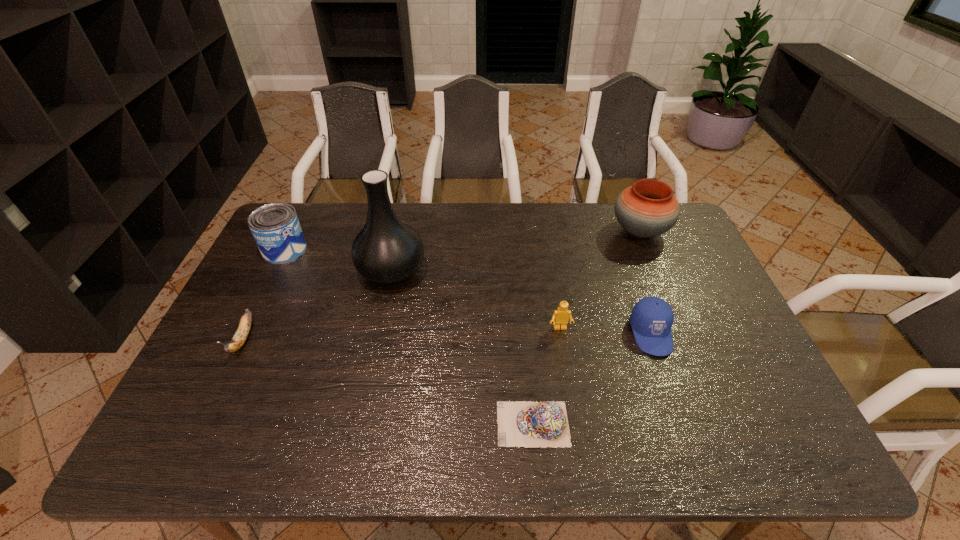
At what (x,y) coordinates should I click in order to perform the action: click on can located at the far edge. Please return your answer as a coordinate pair (x, y). Looking at the image, I should click on (275, 227).

At what (x,y) coordinates should I click in order to perform the action: click on object that is at the near edge. Please return your answer as a coordinate pair (x, y). This screenshot has height=540, width=960. Looking at the image, I should click on (529, 424).

Locate an element on the screen. can that is at the left edge is located at coordinates (275, 227).

Locate an element on the screen. banana that is at the left edge is located at coordinates (240, 336).

Find the location of `object located in the right edge section of the desktop`. object located in the right edge section of the desktop is located at coordinates (648, 208).

In order to click on object that is at the far left corner in this screenshot , I will do `click(275, 227)`.

What are the coordinates of `object present at the far right corner` in the screenshot? It's located at (648, 208).

In order to click on free space at the far edge of the desktop in this screenshot , I will do `click(488, 232)`.

I want to click on free space at the near edge of the desktop, so click(345, 451).

Find the location of `free region at the left edge`. free region at the left edge is located at coordinates (278, 316).